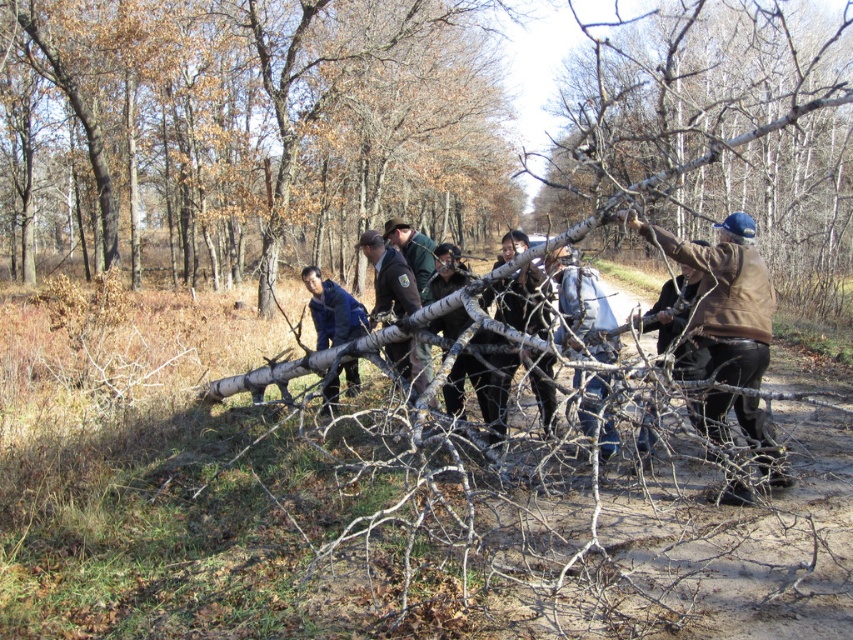
You are a hiker trying to cross a fallen tree branch in the woods. You see the denim jeans at center and the blue fabric jacket at center. Which item is lower to the ground?

The denim jeans at center is lower to the ground compared to the blue fabric jacket at center because the denim jeans at center has a lesser height.

You are a hiker who wants to take a photo of the brown bark tree at center without the blue fabric jacket at center blocking the view. Which direction should you move to ensure the jacket is out of the frame?

The blue fabric jacket at center is behind the brown bark tree at center, so moving forward towards the tree would position the jacket behind the tree, making it less visible in the photo.

You are a hiker carrying a backpack that is 1.8 meters wide. You come across a fallen tree branch blocking your path. You see the denim jeans at center and the blue fabric jacket at center. Can your backpack fit between them without touching either?

The distance between denim jeans at center and blue fabric jacket at center is 2.27 meters. Since your backpack is 1.8 meters wide, it can fit between them as the space is wider than the backpack.